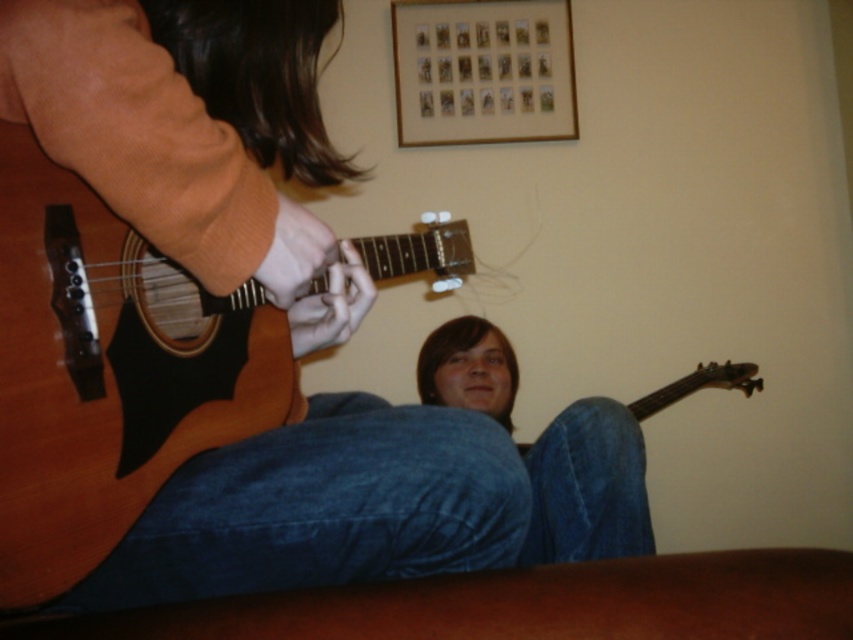
What do you see at coordinates (107, 372) in the screenshot? The height and width of the screenshot is (640, 853). I see `wooden acoustic guitar at left` at bounding box center [107, 372].

Between point (228, 369) and point (563, 525), which one is positioned behind?

The point (563, 525) is more distant.

Identify the location of wooden acoustic guitar at left. This screenshot has width=853, height=640. (107, 372).

Where is `wooden acoustic guitar at left`? wooden acoustic guitar at left is located at coordinates (107, 372).

Can you confirm if wooden acoustic guitar at left is smaller than wooden frame at upper center?

No.

At what (x,y) coordinates should I click in order to perform the action: click on wooden acoustic guitar at left. Please return your answer as a coordinate pair (x, y). Looking at the image, I should click on (107, 372).

Locate an element on the screen. This screenshot has width=853, height=640. wooden acoustic guitar at left is located at coordinates (107, 372).

Which is behind, point (549, 422) or point (553, 115)?

The point (553, 115) is behind.

The image size is (853, 640). What do you see at coordinates (587, 486) in the screenshot? I see `blue denim jeans at lower center` at bounding box center [587, 486].

Which is behind, point (584, 452) or point (415, 70)?

Point (415, 70)

Identify the location of blue denim jeans at lower center. This screenshot has width=853, height=640. (587, 486).